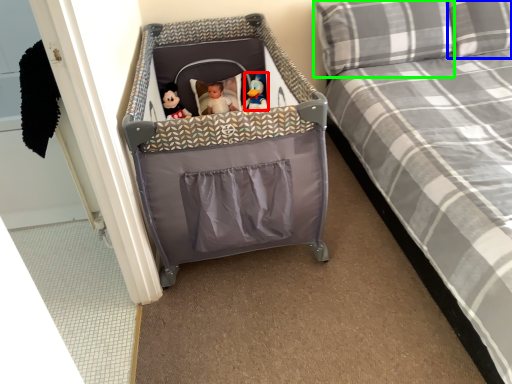
Question: Estimate the real-world distances between objects in this image. Which object is farther from toy (highlighted by a red box), pillow (highlighted by a blue box) or pillow (highlighted by a green box)?

Choices:
 (A) pillow
 (B) pillow

Answer: (A)